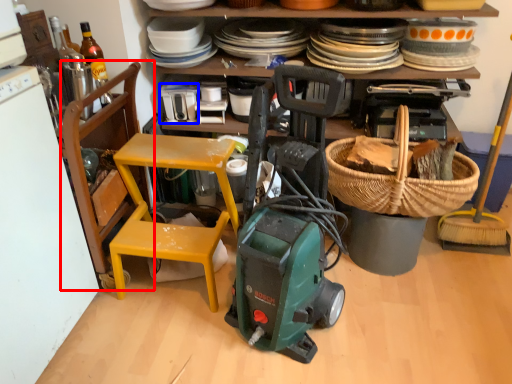
Question: Which point is closer to the camera, chair (highlighted by a red box) or appliance (highlighted by a blue box)?

Choices:
 (A) chair
 (B) appliance

Answer: (A)